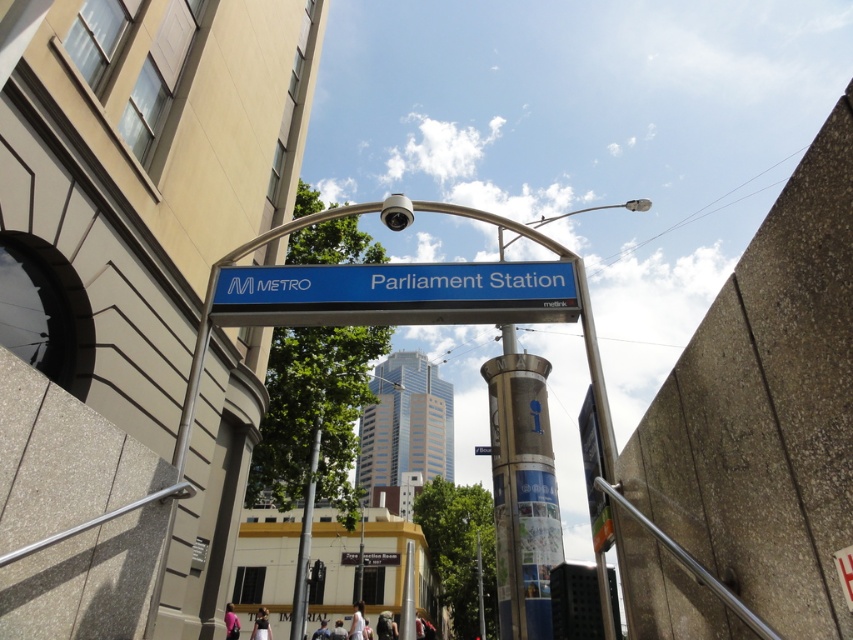
Question: Can you confirm if blue metallic sign at center is positioned to the left of silver metallic pole at center?

Choices:
 (A) yes
 (B) no

Answer: (B)

Question: In this image, where is blue metallic sign at center located relative to silver metallic pole at center?

Choices:
 (A) below
 (B) above

Answer: (B)

Question: Can you confirm if blue metallic sign at center is positioned to the left of silver metallic pole at center?

Choices:
 (A) no
 (B) yes

Answer: (A)

Question: Which object is farther from the camera taking this photo?

Choices:
 (A) silver metallic pole at center
 (B) blue metallic sign at center

Answer: (A)